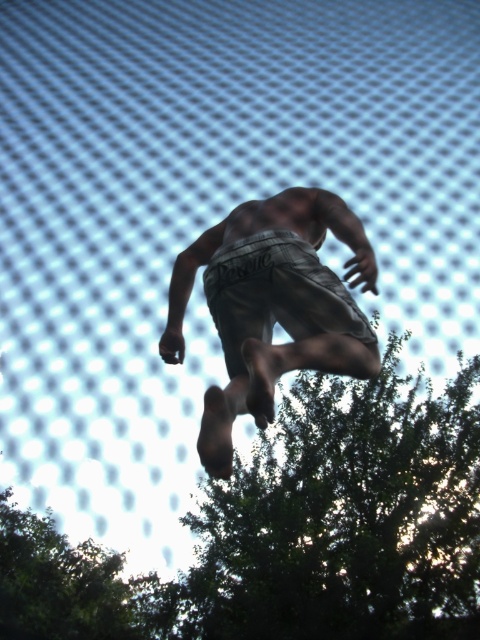
You are a photographer trying to capture the person jumping in the scene. You notice the gray cotton shorts at center and the green leafy tree at lower right. Which object is closer to the camera?

The green leafy tree at lower right is closer to the camera because the gray cotton shorts at center is behind it.

You are a photographer trying to capture the perfect shot of the gray cotton shorts at center and the green leafy tree at lower right. Based on their heights, which object should you focus on first if you want to capture both in a single frame without adjusting your camera angle?

The green leafy tree at lower right has a lesser height compared to gray cotton shorts at center, so you should focus on the gray cotton shorts at center first as it is taller and will occupy more space in the frame.